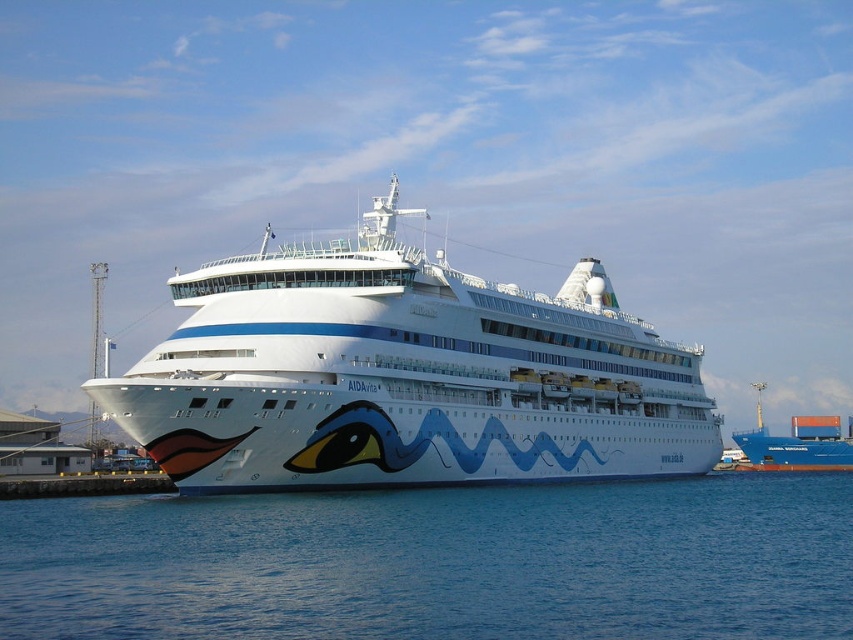
Based on the photo, you are an observer standing on the dock. You see the white glossy cruise ship at center and the blue matte cargo ship at center. Which ship is wider?

The white glossy cruise ship at center is wider than the blue matte cargo ship at center according to the description.

You are a port authority inspector assessing the docking area. You observe the white glossy cruise ship at center and the blue matte cargo ship at center. Which vessel is taller?

→ The white glossy cruise ship at center is taller than the blue matte cargo ship at center according to the description.

You are standing on the dock and see the blue liquid water at lower center and the blue matte cargo ship at center. Which object takes up more space in the image?

The blue matte cargo ship at center takes up more space in the image compared to the blue liquid water at lower center, as the water has a smaller size according to the description.